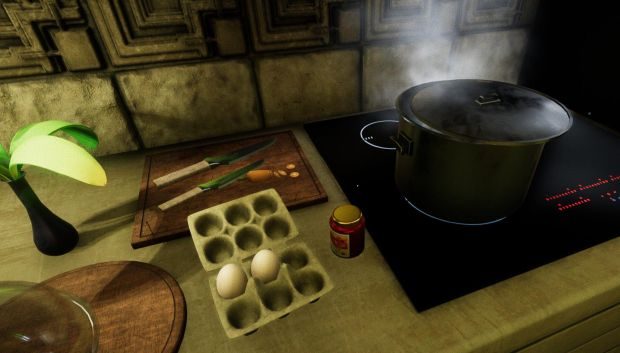
This screenshot has height=353, width=620. Identify the location of rear left burner. (381, 146).